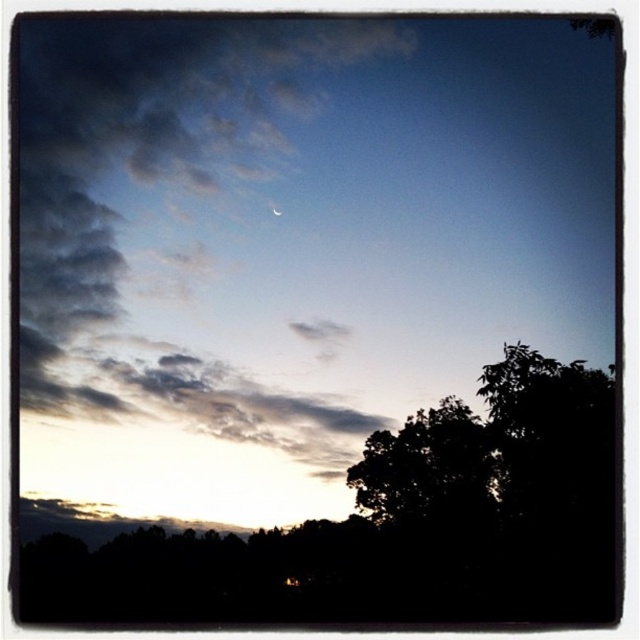
Where is `cloudy sky at upper left`? This screenshot has width=640, height=640. cloudy sky at upper left is located at coordinates (204, 220).

Who is more forward, [35,129] or [273,211]?

Point [35,129] is more forward.

Is point (125, 332) positioned behind point (278, 212)?

No.

Identify the location of cloudy sky at upper left. (204, 220).

How far apart are silhouette leafy tree at lower right and satin silver crescent at upper center?

15.30 meters

Which of these two, silhouette leafy tree at lower right or satin silver crescent at upper center, stands taller?

With more height is silhouette leafy tree at lower right.

Where is `silhouette leafy tree at lower right`? silhouette leafy tree at lower right is located at coordinates (392, 525).

In the scene shown: Can you confirm if cloudy sky at upper left is wider than silhouette leafy tree at lower right?

Incorrect, cloudy sky at upper left's width does not surpass silhouette leafy tree at lower right's.

Is cloudy sky at upper left thinner than silhouette leafy tree at lower right?

Yes.

You are a GUI agent. You are given a task and a screenshot of the screen. Output one action in this format:
    pyautogui.click(x=<x>, y=<y>)
    Task: Click on the cloudy sky at upper left
    
    Given the screenshot: What is the action you would take?
    pyautogui.click(x=204, y=220)